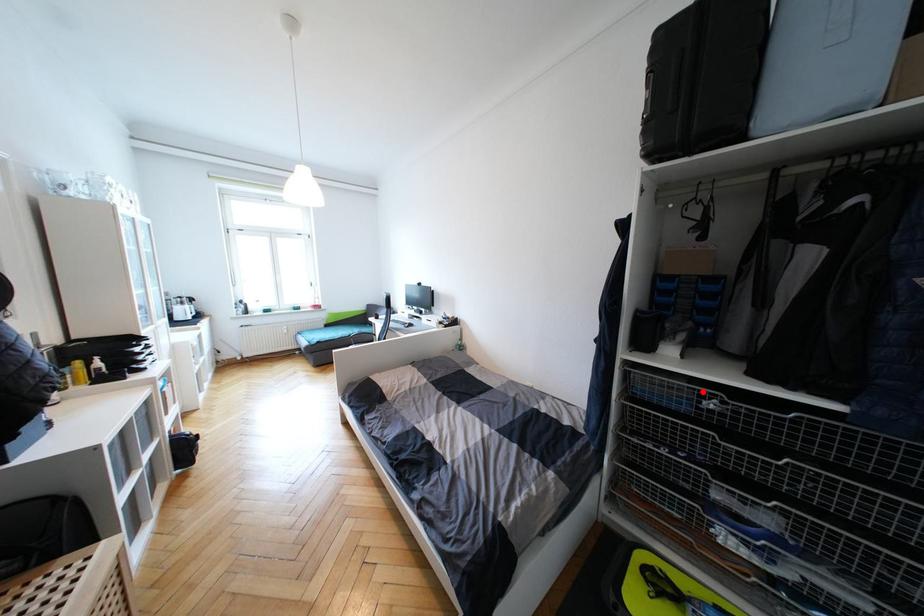
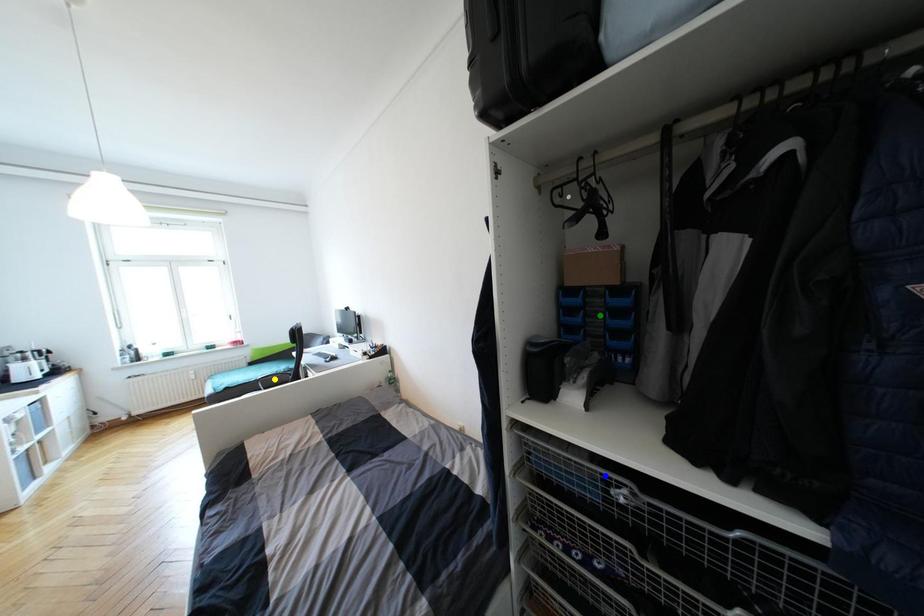
Question: I am providing you with two images of the same scene from different viewpoints. A red point is marked on the first image. You are given multiple points on the second image. Which mark in image 2 goes with the point in image 1?

Choices:
 (A) yellow point
 (B) blue point
 (C) green point

Answer: (B)